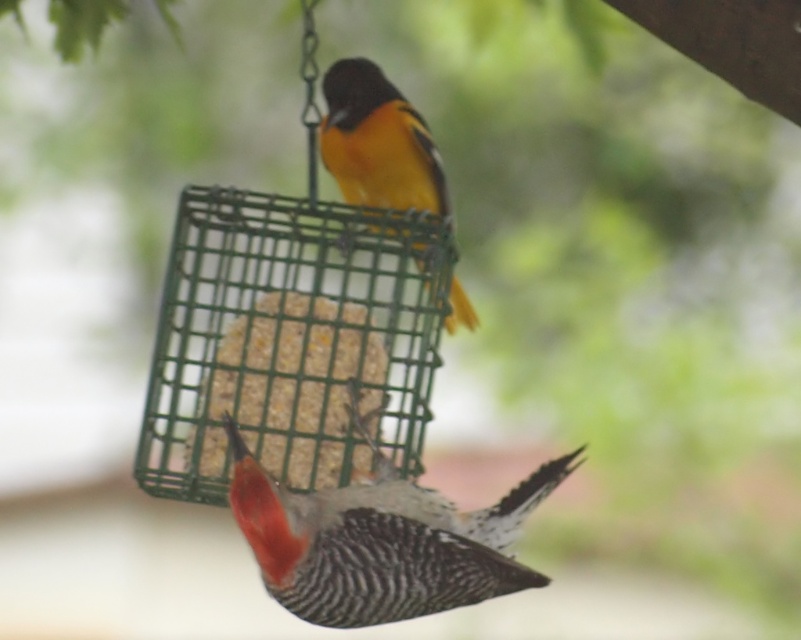
Question: Which of the following is the farthest from the observer?

Choices:
 (A) speckled gray woodpecker at center
 (B) speckled gray woodpecker at lower center

Answer: (A)

Question: Does speckled gray woodpecker at lower center have a smaller size compared to speckled gray woodpecker at center?

Choices:
 (A) yes
 (B) no

Answer: (B)

Question: Is speckled gray woodpecker at lower center to the left of speckled gray woodpecker at center from the viewer's perspective?

Choices:
 (A) no
 (B) yes

Answer: (A)

Question: Is speckled gray woodpecker at lower center positioned at the back of speckled gray woodpecker at center?

Choices:
 (A) no
 (B) yes

Answer: (A)